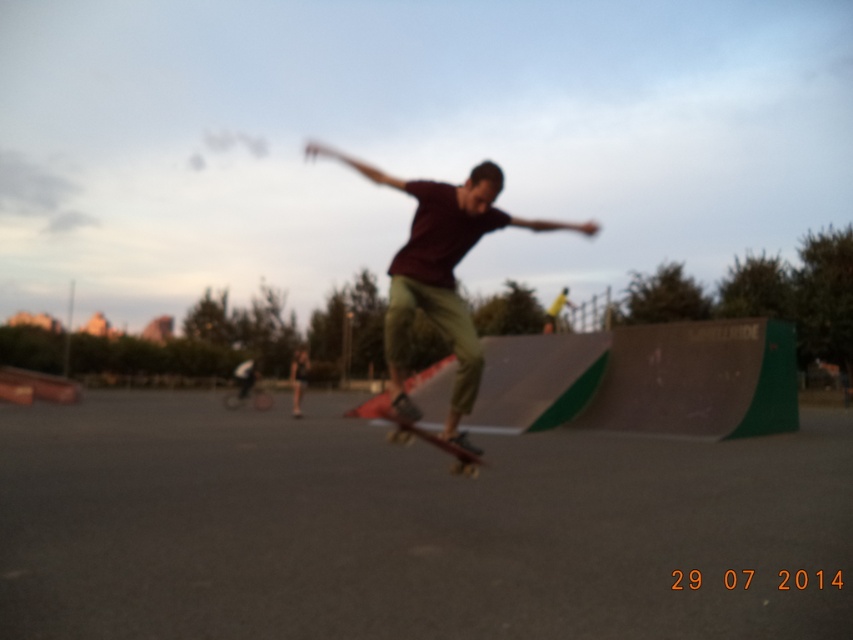
You are a photographer at the skatepark and want to capture both the matte black skateboard at center and the wooden skateboard at center in a single shot. Which skateboard should you focus on first to ensure both are in frame?

The matte black skateboard at center is in front of the wooden skateboard at center, so focusing on the matte black skateboard at center first will ensure both are in frame as the wooden skateboard at center is behind it.

You are a photographer trying to capture both the matte black skateboard at center and the wooden skateboard at center in a single shot. Given their widths, which skateboard will appear wider in the photo?

The matte black skateboard at center will appear wider in the photo because its width surpasses that of the wooden skateboard at center.